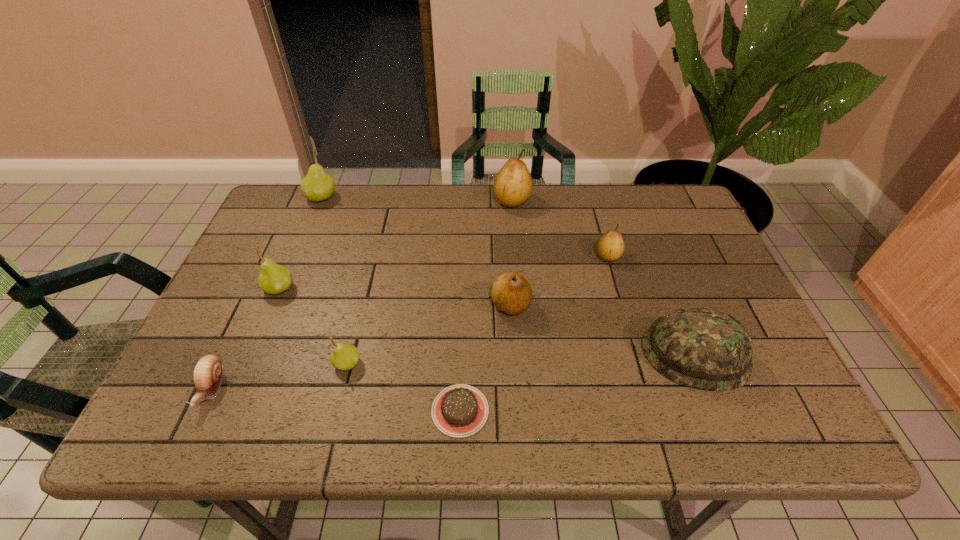
This screenshot has width=960, height=540. In order to click on escargot that is at the near edge in this screenshot , I will do `click(208, 373)`.

The height and width of the screenshot is (540, 960). What are the coordinates of `chocolate cake that is at the near edge` in the screenshot? It's located at 460,410.

The image size is (960, 540). Find the location of `escargot that is at the left edge`. escargot that is at the left edge is located at coordinates (208, 373).

Find the location of a particular element. object located at the right edge is located at coordinates (698, 347).

Where is `object situated at the far left corner`? This screenshot has height=540, width=960. object situated at the far left corner is located at coordinates (317, 185).

I want to click on object located at the near left corner, so click(208, 373).

The height and width of the screenshot is (540, 960). I want to click on free region at the far edge, so click(x=385, y=185).

I want to click on free space at the near edge, so click(295, 425).

This screenshot has width=960, height=540. I want to click on free space at the far left corner of the desktop, so click(298, 222).

In order to click on free space at the near left corner of the desktop in this screenshot , I will do `click(193, 429)`.